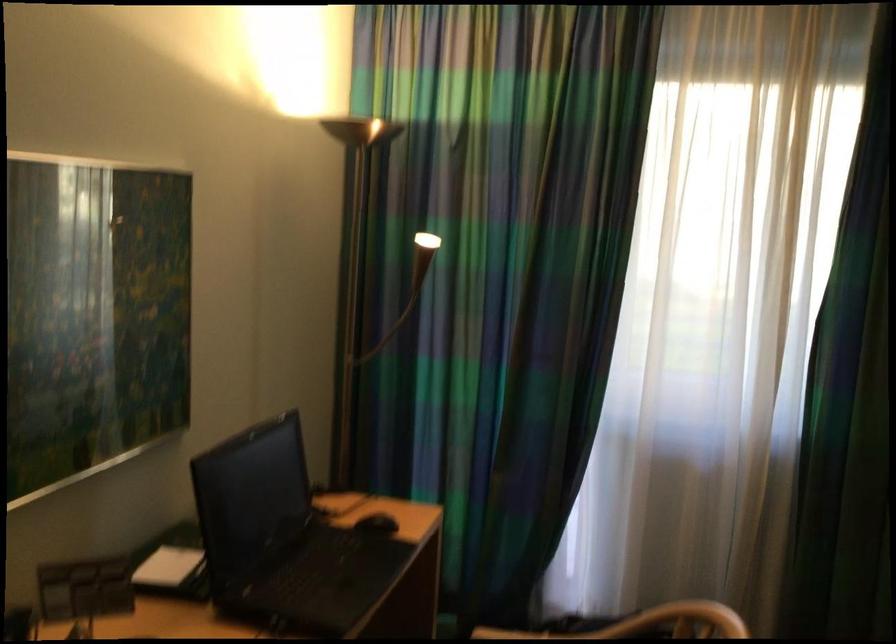
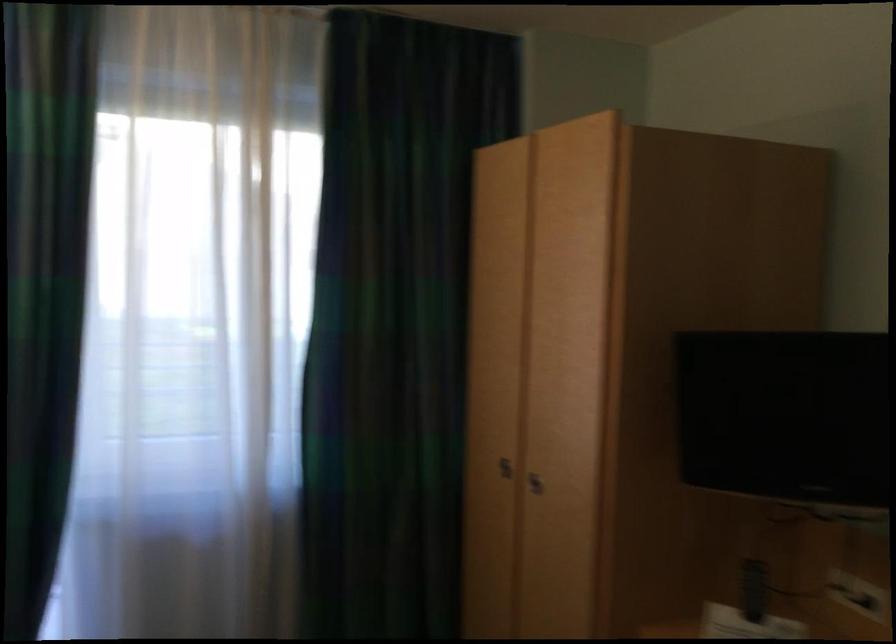
Question: The first image is from the beginning of the video and the second image is from the end. How did the camera likely rotate when shooting the video?

Choices:
 (A) Left
 (B) Right
 (C) Up
 (D) Down

Answer: (B)